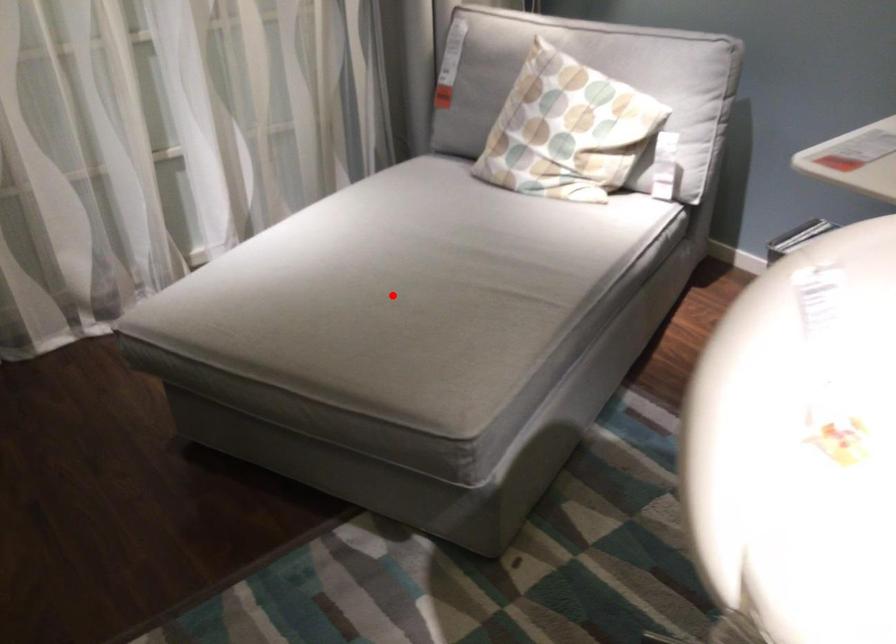
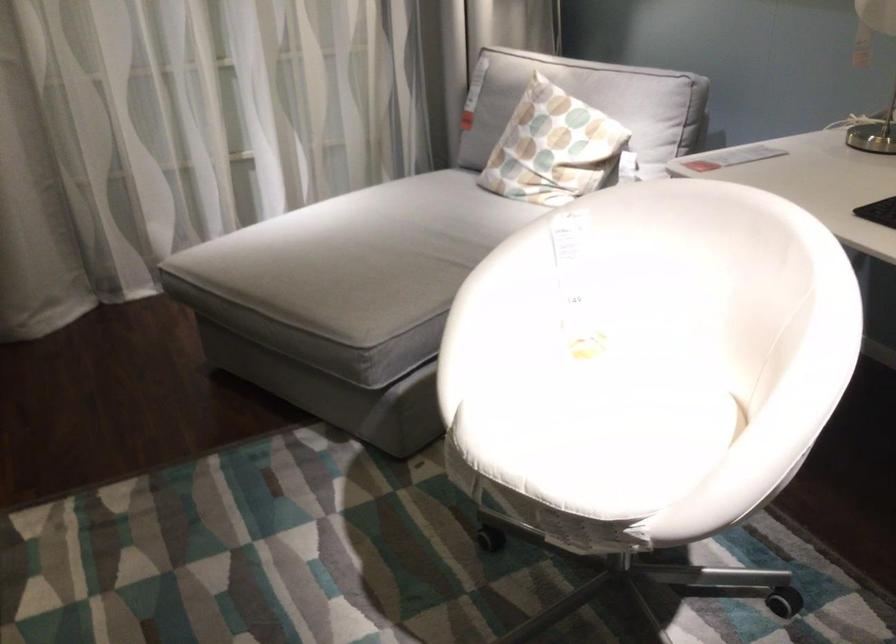
Question: I am providing you with two images of the same scene from different viewpoints. In image1, a red point is highlighted. Considering the same 3D point in image2, which of the following is correct?

Choices:
 (A) It is closer
 (B) It is farther

Answer: (B)